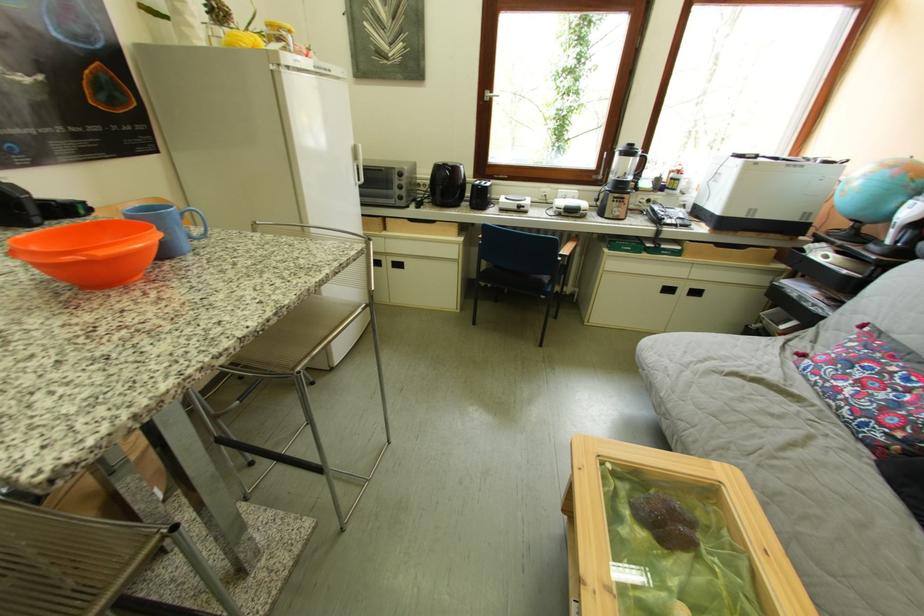
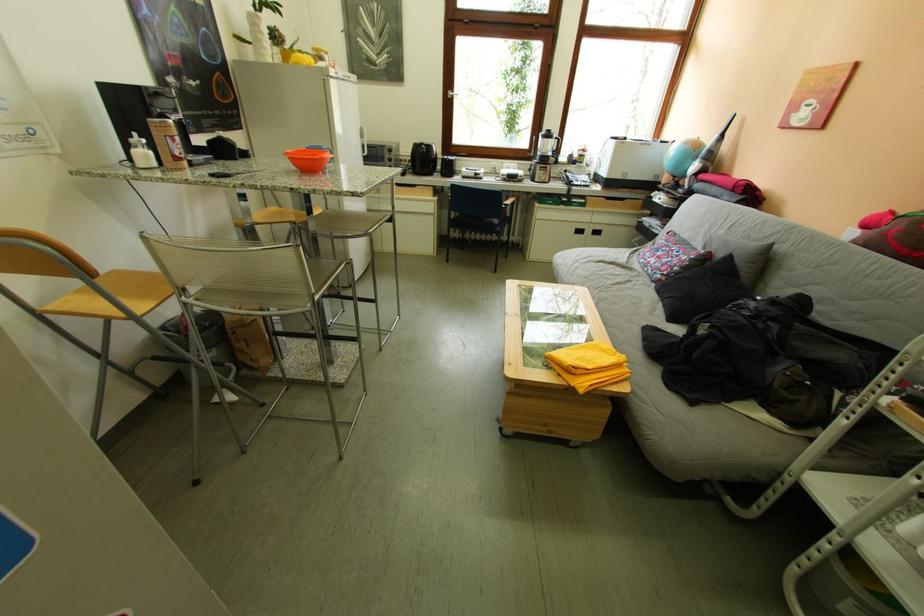
Locate, in the second image, the point that corresponds to (841,384) in the first image.

(659, 262)